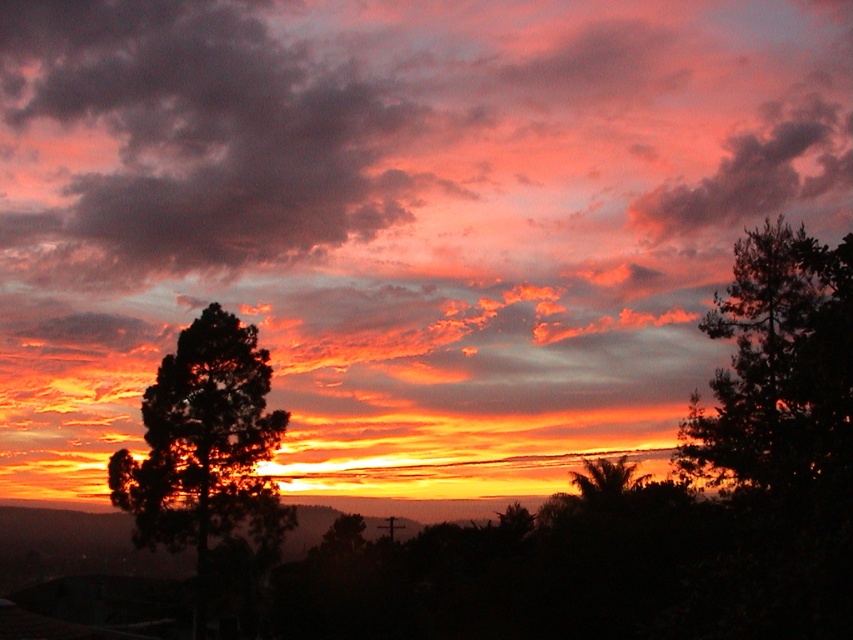
Question: Among these objects, which one is nearest to the camera?

Choices:
 (A) matte pink cloud at upper right
 (B) dark green textured tree at right

Answer: (B)

Question: Considering the real-world distances, which object is farthest from the dark green textured tree at right?

Choices:
 (A) dark pink cotton clouds at upper center
 (B) dark green leafy tree at left
 (C) matte pink cloud at upper right

Answer: (A)

Question: Does dark green textured tree at right have a greater width compared to matte pink cloud at upper right?

Choices:
 (A) yes
 (B) no

Answer: (B)

Question: Does dark pink cotton clouds at upper center have a greater width compared to dark green textured tree at right?

Choices:
 (A) yes
 (B) no

Answer: (A)

Question: Can you confirm if dark green leafy tree at left is wider than matte pink cloud at upper right?

Choices:
 (A) no
 (B) yes

Answer: (A)

Question: Estimate the real-world distances between objects in this image. Which object is farther from the dark pink cotton clouds at upper center?

Choices:
 (A) matte pink cloud at upper right
 (B) dark green leafy tree at left

Answer: (B)